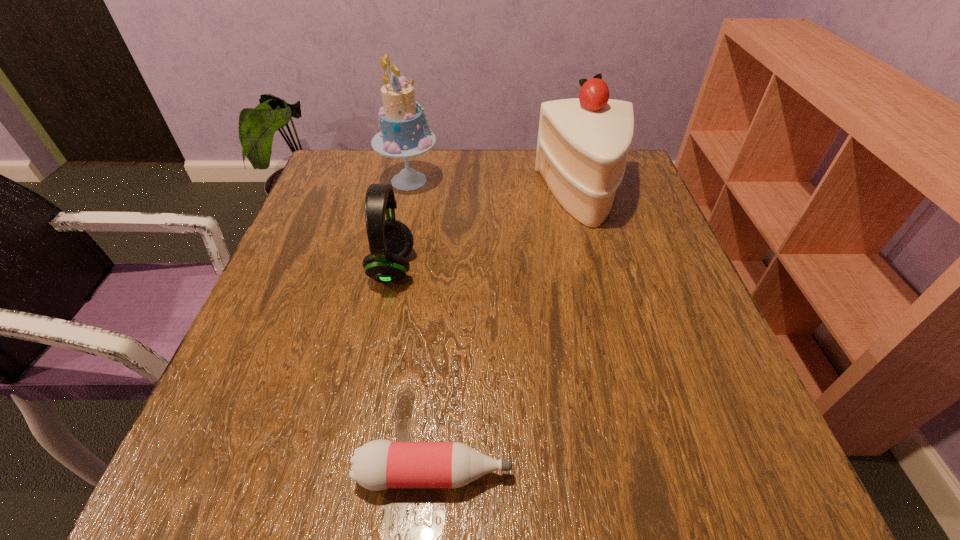
Image resolution: width=960 pixels, height=540 pixels. I want to click on vacant region between the tallest object and the bottle, so click(x=421, y=327).

Image resolution: width=960 pixels, height=540 pixels. I want to click on vacant area that lies between the shorter cake and the tallest object, so (496, 189).

At what (x,y) coordinates should I click in order to perform the action: click on free space between the shorter cake and the tallest object. Please return your answer as a coordinate pair (x, y). Looking at the image, I should click on (496, 189).

Identify the location of free space between the taller cake and the second tallest object. (496, 189).

Image resolution: width=960 pixels, height=540 pixels. Find the location of `object that is the nearest to the tallest object`. object that is the nearest to the tallest object is located at coordinates (390, 241).

Select which object is the third closest to the shortest object. Please provide its 2D coordinates. Your answer should be formatted as a tuple, i.e. [(x, y)], where the tuple contains the x and y coordinates of a point satisfying the conditions above.

[(404, 134)]

The width and height of the screenshot is (960, 540). Find the location of `vacant space that satisfies the following two spatial constraints: 1. with a ladder on the side of the left cake; 2. on the left side of the shorter cake`. vacant space that satisfies the following two spatial constraints: 1. with a ladder on the side of the left cake; 2. on the left side of the shorter cake is located at coordinates (406, 197).

At what (x,y) coordinates should I click in order to perform the action: click on free region that satisfies the following two spatial constraints: 1. with a ladder on the side of the right cake; 2. on the left side of the tallest object. Please return your answer as a coordinate pair (x, y). The width and height of the screenshot is (960, 540). Looking at the image, I should click on (406, 197).

At what (x,y) coordinates should I click in order to perform the action: click on vacant space that satisfies the following two spatial constraints: 1. on the front side of the right cake; 2. with the cap open on the shortest object. Please return your answer as a coordinate pair (x, y). The height and width of the screenshot is (540, 960). Looking at the image, I should click on (663, 474).

This screenshot has width=960, height=540. Find the location of `free region that satisfies the following two spatial constraints: 1. on the back side of the right cake; 2. with a ladder on the side of the taller cake`. free region that satisfies the following two spatial constraints: 1. on the back side of the right cake; 2. with a ladder on the side of the taller cake is located at coordinates (579, 181).